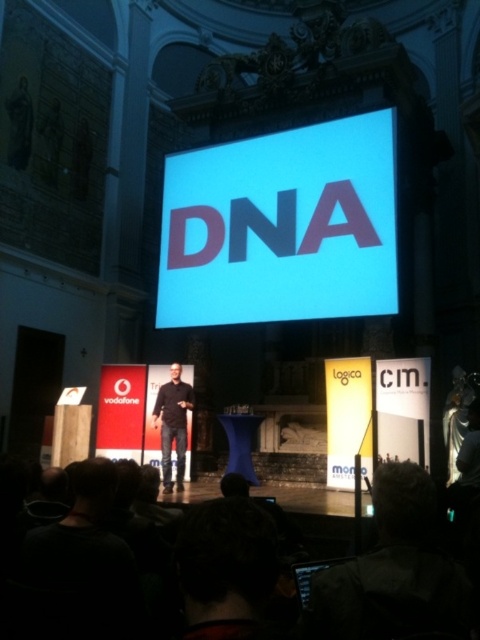
Can you confirm if dark brown leather jacket at lower center is wider than black matte shirt at center?

Correct, the width of dark brown leather jacket at lower center exceeds that of black matte shirt at center.

Is dark brown leather jacket at lower center positioned in front of black matte shirt at center?

Yes, dark brown leather jacket at lower center is closer to the viewer.

Who is more distant from viewer, (444, 609) or (165, 488)?

Positioned behind is point (165, 488).

The image size is (480, 640). I want to click on dark brown leather jacket at lower center, so click(394, 570).

Can you confirm if white glossy projection screen at center is wider than black matte shirt at center?

Correct, the width of white glossy projection screen at center exceeds that of black matte shirt at center.

Which is more to the left, white glossy projection screen at center or black matte shirt at center?

black matte shirt at center is more to the left.

Is point (195, 250) positioned in front of point (168, 476)?

No, it is not.

Where is `white glossy projection screen at center`? white glossy projection screen at center is located at coordinates (282, 227).

Does white glossy projection screen at center appear over dark brown leather jacket at lower center?

Correct, white glossy projection screen at center is located above dark brown leather jacket at lower center.

Does white glossy projection screen at center lie behind dark brown leather jacket at lower center?

Yes.

Who is more forward, (326, 300) or (408, 557)?

Point (408, 557) is more forward.

The image size is (480, 640). Identify the location of white glossy projection screen at center. (282, 227).